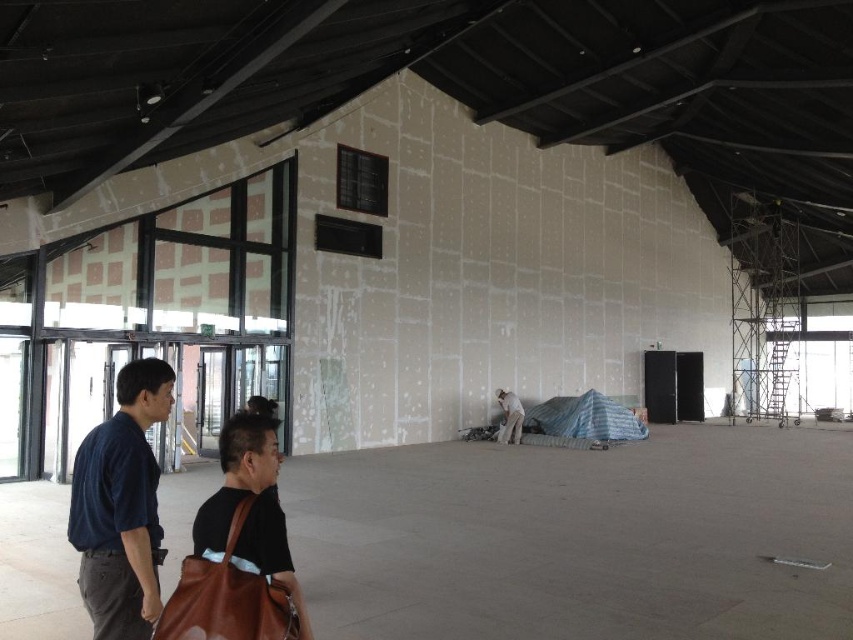
Question: Where is dark blue shirt at left located in relation to brown leather bag at lower center in the image?

Choices:
 (A) right
 (B) left

Answer: (B)

Question: Among these points, which one is nearest to the camera?

Choices:
 (A) (270, 424)
 (B) (219, 568)
 (C) (511, 417)

Answer: (B)

Question: Considering the real-world distances, which object is farthest from the white matte man at center?

Choices:
 (A) brown leather bag at lower left
 (B) brown leather bag at lower center

Answer: (B)

Question: Can you confirm if dark blue shirt at left is positioned below brown leather bag at lower center?

Choices:
 (A) no
 (B) yes

Answer: (A)

Question: Can you confirm if dark blue shirt at left is smaller than brown leather bag at lower center?

Choices:
 (A) yes
 (B) no

Answer: (B)

Question: Estimate the real-world distances between objects in this image. Which object is farther from the brown leather bag at lower left?

Choices:
 (A) white matte man at center
 (B) brown leather bag at lower center

Answer: (A)